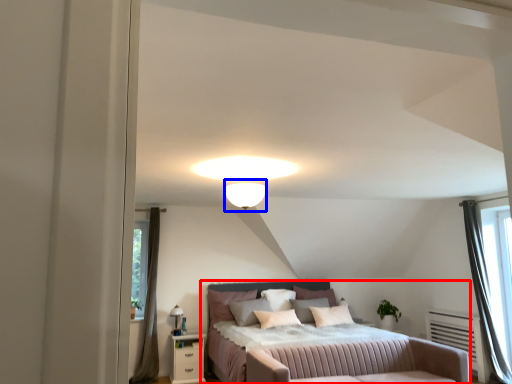
Question: Which object appears farthest to the camera in this image, bed (highlighted by a red box) or lighting (highlighted by a blue box)?

Choices:
 (A) bed
 (B) lighting

Answer: (A)